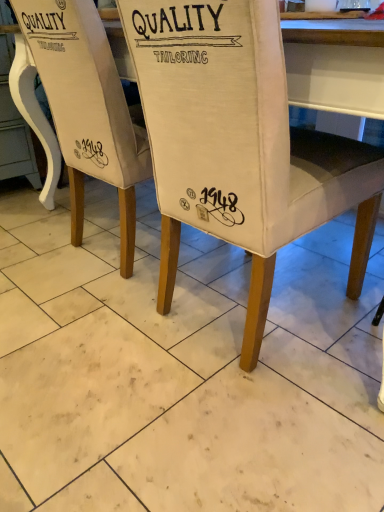
Locate an element on the screen. Image resolution: width=384 pixels, height=512 pixels. blank area beneath canvas chair at center, arranged as the second chair when viewed from the right (from a real-world perspective) is located at coordinates coord(135,247).